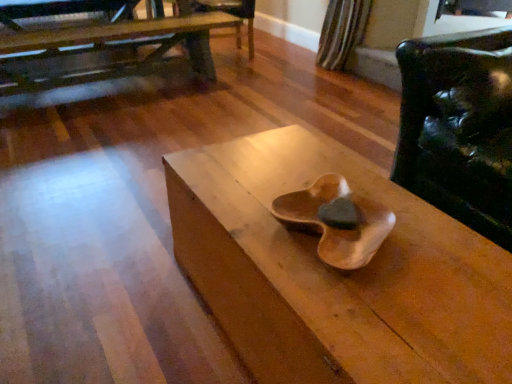
Identify the location of glossy leather chair at right. The image size is (512, 384). (459, 127).

Find the location of a particular element. The height and width of the screenshot is (384, 512). wooden armchair at center is located at coordinates (232, 14).

What do you see at coordinates (335, 273) in the screenshot? This screenshot has height=384, width=512. I see `wooden table at center, which ranks as the 2th table in back-to-front order` at bounding box center [335, 273].

This screenshot has width=512, height=384. Identify the location of glossy leather chair at right. (459, 127).

Which table is the 1st one when counting from the front of the wooden armchair at center? Please provide its 2D coordinates.

[(104, 50)]

Is wooden table at upper left, which appears as the first table when viewed from the back, wider than wooden armchair at center?

Indeed, wooden table at upper left, which appears as the first table when viewed from the back, has a greater width compared to wooden armchair at center.

Does wooden table at center, positioned as the 2th table in left-to-right order, have a greater height compared to wooden table at upper left, positioned as the second table in front-to-back order?

No, wooden table at center, positioned as the 2th table in left-to-right order, is not taller than wooden table at upper left, positioned as the second table in front-to-back order.

Which object is positioned more to the left, wooden table at center, which ranks as the 2th table in back-to-front order, or wooden table at upper left, which ranks as the first table in top-to-bottom order?

From the viewer's perspective, wooden table at upper left, which ranks as the first table in top-to-bottom order, appears more on the left side.

Can you tell me how much wooden table at center, which ranks as the 2th table in back-to-front order, and wooden table at upper left, which ranks as the first table in top-to-bottom order, differ in facing direction?

91.8 degrees separate the facing orientations of wooden table at center, which ranks as the 2th table in back-to-front order, and wooden table at upper left, which ranks as the first table in top-to-bottom order.

Identify the location of table behind the glossy leather chair at right. (104, 50).

Which object is positioned more to the right, wooden table at upper left, arranged as the 1th table when viewed from the left, or glossy leather chair at right?

Positioned to the right is glossy leather chair at right.

From the image's perspective, is wooden table at upper left, positioned as the 2th table in bottom-to-top order, beneath glossy leather chair at right?

Actually, wooden table at upper left, positioned as the 2th table in bottom-to-top order, appears above glossy leather chair at right in the image.

Are wooden table at upper left, which appears as the first table when viewed from the back, and glossy leather chair at right located far from each other?

Yes.

Looking at this image, could you tell me if wooden armchair at center is facing wooden table at center, which is the 1th table from front to back?

No, wooden armchair at center is not facing towards wooden table at center, which is the 1th table from front to back.

Who is bigger, wooden armchair at center or wooden table at center, which is the 1th table from front to back?

With larger size is wooden table at center, which is the 1th table from front to back.

Which is less distant, (193, 1) or (342, 354)?

Positioned in front is point (342, 354).

Considering the sizes of wooden armchair at center and wooden table at center, positioned as the 2th table in left-to-right order, in the image, is wooden armchair at center taller or shorter than wooden table at center, positioned as the 2th table in left-to-right order,?

In the image, wooden armchair at center appears to be taller than wooden table at center, positioned as the 2th table in left-to-right order.

From a real-world perspective, who is located higher, glossy leather chair at right or wooden table at center, which ranks as the 2th table in back-to-front order?

In real-world perspective, glossy leather chair at right is above.

You are a GUI agent. You are given a task and a screenshot of the screen. Output one action in this format:
    pyautogui.click(x=<x>, y=<y>)
    Task: Click on the chair lying on the right of wooden table at center, positioned as the 2th table in left-to-right order
    
    Given the screenshot: What is the action you would take?
    pyautogui.click(x=459, y=127)

Is glossy leather chair at right looking in the opposite direction of wooden table at center, positioned as the first table in bottom-to-top order?

glossy leather chair at right is not turned away from wooden table at center, positioned as the first table in bottom-to-top order.

Which is correct: glossy leather chair at right is inside wooden table at center, which is the 1th table from right to left, or outside of it?

glossy leather chair at right is not enclosed by wooden table at center, which is the 1th table from right to left.

In the scene shown: Between wooden table at center, marked as the 2th table in a top-to-bottom arrangement, and glossy leather chair at right, which one appears on the right side from the viewer's perspective?

glossy leather chair at right.

Considering the relative sizes of wooden table at center, which ranks as the 2th table in back-to-front order, and glossy leather chair at right in the image provided, is wooden table at center, which ranks as the 2th table in back-to-front order, taller than glossy leather chair at right?

Incorrect, the height of wooden table at center, which ranks as the 2th table in back-to-front order, is not larger of that of glossy leather chair at right.

Which of these two, wooden table at center, which is the 1th table from front to back, or glossy leather chair at right, is wider?

Wider between the two is glossy leather chair at right.

Looking at this image, from the image's perspective, is wooden table at center, positioned as the first table in bottom-to-top order, beneath glossy leather chair at right?

Correct, wooden table at center, positioned as the first table in bottom-to-top order, appears lower than glossy leather chair at right in the image.

Can you confirm if wooden armchair at center is smaller than wooden table at upper left, which appears as the first table when viewed from the back?

Yes.

Does wooden armchair at center have a lesser width compared to wooden table at upper left, which appears as the first table when viewed from the back?

Correct, the width of wooden armchair at center is less than that of wooden table at upper left, which appears as the first table when viewed from the back.

Is wooden armchair at center inside or outside of wooden table at upper left, which appears as the first table when viewed from the back?

wooden armchair at center is contained in wooden table at upper left, which appears as the first table when viewed from the back.

You are a GUI agent. You are given a task and a screenshot of the screen. Output one action in this format:
    pyautogui.click(x=<x>, y=<y>)
    Task: Click on the armchair on the right of wooden table at upper left, which ranks as the first table in top-to-bottom order
    
    Given the screenshot: What is the action you would take?
    pyautogui.click(x=232, y=14)

I want to click on table in front of the wooden table at upper left, which appears as the first table when viewed from the back, so click(335, 273).

From the image, which object appears to be farther from glossy leather chair at right, wooden armchair at center or wooden table at center, positioned as the first table in bottom-to-top order?

wooden armchair at center.

Considering their positions, is wooden table at upper left, which appears as the first table when viewed from the back, positioned further to wooden table at center, which is the 1th table from right to left, than glossy leather chair at right?

Among the two, wooden table at upper left, which appears as the first table when viewed from the back, is located further to wooden table at center, which is the 1th table from right to left.

From the image, which object appears to be farther from wooden table at upper left, arranged as the 1th table when viewed from the left, glossy leather chair at right or wooden table at center, positioned as the 2th table in left-to-right order?

Based on the image, glossy leather chair at right appears to be further to wooden table at upper left, arranged as the 1th table when viewed from the left.

Looking at the image, which one is located closer to glossy leather chair at right, wooden table at upper left, which ranks as the first table in top-to-bottom order, or wooden table at center, marked as the 2th table in a top-to-bottom arrangement?

Based on the image, wooden table at center, marked as the 2th table in a top-to-bottom arrangement, appears to be nearer to glossy leather chair at right.

Looking at the image, which one is located closer to wooden table at upper left, positioned as the second table in front-to-back order, wooden armchair at center or glossy leather chair at right?

wooden armchair at center lies closer to wooden table at upper left, positioned as the second table in front-to-back order, than the other object.

From the image, which object appears to be farther from wooden armchair at center, wooden table at center, marked as the 2th table in a top-to-bottom arrangement, or glossy leather chair at right?

wooden table at center, marked as the 2th table in a top-to-bottom arrangement, is positioned further to the anchor wooden armchair at center.

Based on their spatial positions, is wooden armchair at center or wooden table at upper left, which ranks as the first table in top-to-bottom order, closer to wooden table at center, marked as the 2th table in a top-to-bottom arrangement?

wooden table at upper left, which ranks as the first table in top-to-bottom order.

When comparing their distances from glossy leather chair at right, does wooden armchair at center or wooden table at upper left, positioned as the 2th table in bottom-to-top order, seem further?

Among the two, wooden table at upper left, positioned as the 2th table in bottom-to-top order, is located further to glossy leather chair at right.

Identify the location of table between wooden table at center, which is the 1th table from front to back, and wooden armchair at center from front to back. The width and height of the screenshot is (512, 384). (104, 50).

At what (x,y) coordinates should I click in order to perform the action: click on armchair located between wooden table at upper left, positioned as the 2th table in bottom-to-top order, and glossy leather chair at right in the left-right direction. Please return your answer as a coordinate pair (x, y). The width and height of the screenshot is (512, 384). Looking at the image, I should click on (232, 14).

You are a GUI agent. You are given a task and a screenshot of the screen. Output one action in this format:
    pyautogui.click(x=<x>, y=<y>)
    Task: Click on the chair located between wooden table at center, marked as the 2th table in a top-to-bottom arrangement, and wooden armchair at center in the depth direction
    
    Given the screenshot: What is the action you would take?
    pyautogui.click(x=459, y=127)

Locate an element on the screen. This screenshot has height=384, width=512. table situated between wooden table at upper left, positioned as the second table in front-to-back order, and glossy leather chair at right from left to right is located at coordinates (335, 273).